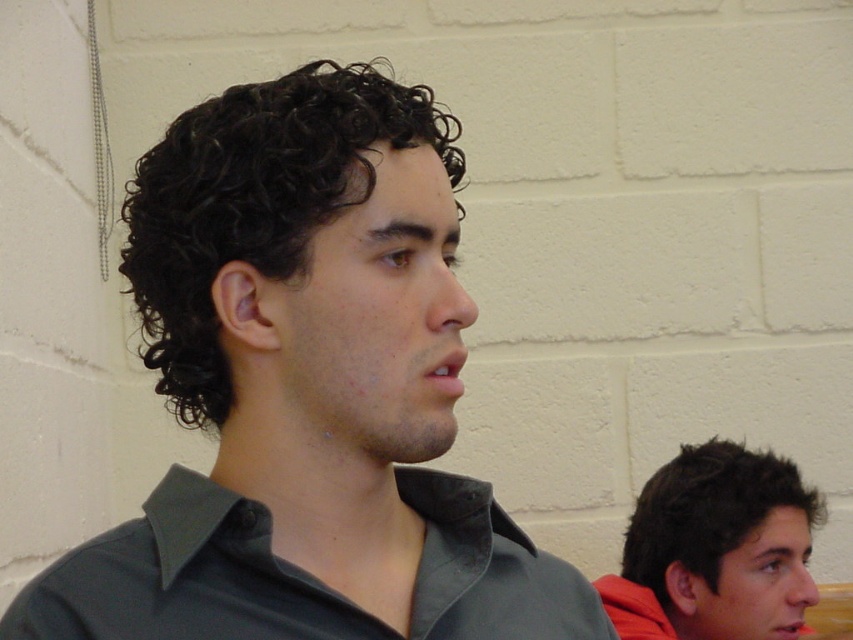
Does point (358, 547) come in front of point (500, 580)?

That is True.

Describe the element at coordinates (306, 388) in the screenshot. The width and height of the screenshot is (853, 640). I see `dark green shirt at center` at that location.

Locate an element on the screen. This screenshot has width=853, height=640. dark green shirt at center is located at coordinates (306, 388).

Between dark green shirt at center and dark curly hair at center, which one is positioned lower?

→ Positioned lower is dark green shirt at center.

Is point (247, 417) less distant than point (291, 120)?

No, it is behind (291, 120).

Find the location of a particular element. Image resolution: width=853 pixels, height=640 pixels. dark green shirt at center is located at coordinates (306, 388).

Is point (544, 624) closer to camera compared to point (660, 470)?

Yes, point (544, 624) is in front of point (660, 470).

Is dark gray cotton shirt at center below dark brown curly hair at lower right?

No, dark gray cotton shirt at center is not below dark brown curly hair at lower right.

Between point (149, 616) and point (726, 520), which one is positioned behind?

The point (726, 520) is behind.

Find the location of a particular element. dark gray cotton shirt at center is located at coordinates (300, 576).